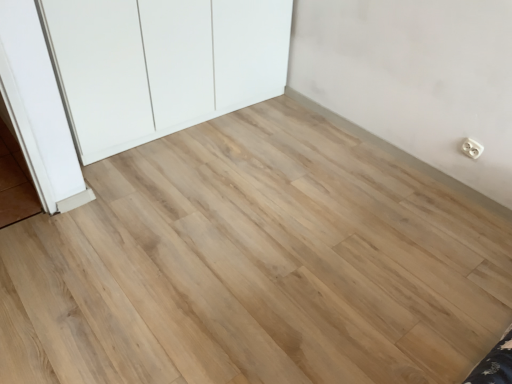
Identify the location of free point in front of white matte door at upper left. Image resolution: width=512 pixels, height=384 pixels. (179, 216).